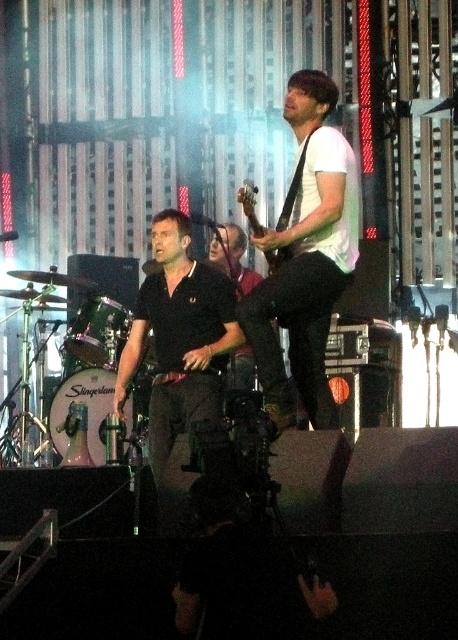
Question: Observing the image, what is the correct spatial positioning of white matte shirt at upper center in reference to black matte shirt at center?

Choices:
 (A) above
 (B) below

Answer: (A)

Question: Among these objects, which one is nearest to the camera?

Choices:
 (A) white matte shirt at upper center
 (B) black matte shirt at center

Answer: (B)

Question: Does white matte shirt at upper center have a greater width compared to black matte shirt at center?

Choices:
 (A) no
 (B) yes

Answer: (A)

Question: Which point is closer to the camera taking this photo?

Choices:
 (A) (156, 394)
 (B) (301, 115)

Answer: (B)

Question: In this image, where is white matte shirt at upper center located relative to black matte shirt at center?

Choices:
 (A) above
 (B) below

Answer: (A)

Question: Among these objects, which one is nearest to the camera?

Choices:
 (A) black matte shirt at center
 (B) white matte shirt at upper center

Answer: (A)